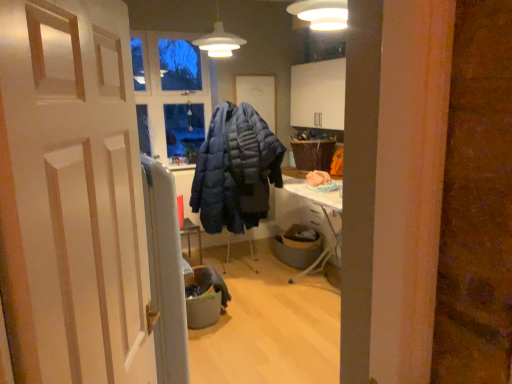
Question: From a real-world perspective, is white wooden door at center beneath matte blue puffer jacket at center?

Choices:
 (A) yes
 (B) no

Answer: (B)

Question: Can you confirm if white wooden door at center is taller than matte blue puffer jacket at center?

Choices:
 (A) no
 (B) yes

Answer: (A)

Question: Is white wooden door at center to the left of matte blue puffer jacket at center from the viewer's perspective?

Choices:
 (A) no
 (B) yes

Answer: (B)

Question: Is white wooden door at center turned away from matte blue puffer jacket at center?

Choices:
 (A) no
 (B) yes

Answer: (A)

Question: Is white wooden door at center further to camera compared to matte blue puffer jacket at center?

Choices:
 (A) no
 (B) yes

Answer: (A)

Question: Is matte blue puffer jacket at center surrounded by white wooden door at center?

Choices:
 (A) no
 (B) yes

Answer: (A)

Question: From the image's perspective, would you say woven brown picnic basket at upper right is shown under matte blue puffer jacket at center?

Choices:
 (A) yes
 (B) no

Answer: (B)

Question: From a real-world perspective, is woven brown picnic basket at upper right positioned under matte blue puffer jacket at center based on gravity?

Choices:
 (A) yes
 (B) no

Answer: (B)

Question: Can we say woven brown picnic basket at upper right lies outside matte blue puffer jacket at center?

Choices:
 (A) no
 (B) yes

Answer: (B)

Question: From a real-world perspective, is woven brown picnic basket at upper right on top of matte blue puffer jacket at center?

Choices:
 (A) no
 (B) yes

Answer: (B)

Question: Does woven brown picnic basket at upper right come in front of matte blue puffer jacket at center?

Choices:
 (A) no
 (B) yes

Answer: (A)

Question: Would you say woven brown picnic basket at upper right contains matte blue puffer jacket at center?

Choices:
 (A) yes
 (B) no

Answer: (B)

Question: Is white wooden door at center completely or partially inside gray fabric trash bin at center, placed as the 2th trash bin/can when sorted from right to left?

Choices:
 (A) no
 (B) yes

Answer: (A)